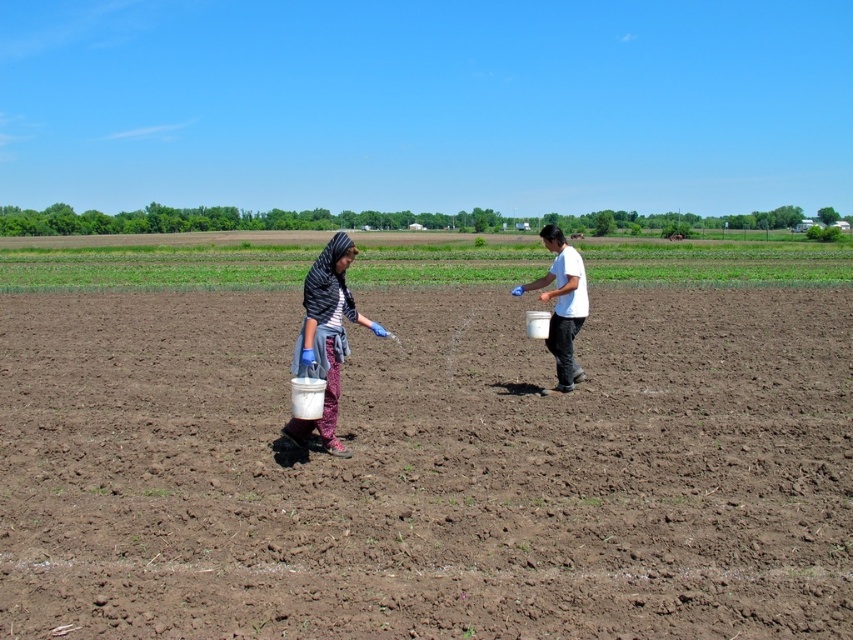
You are standing at the origin point in the field. There is a brown soil at center marked by point (x=428, y=470). If you walk straight north, will you reach the green trees before the brown soil at center?

The point (x=428, y=470) marks the brown soil at center, so walking north from the origin would head towards the green trees in the background first before reaching the brown soil at center.

You are a farmer planning to place the white plastic bucket at center on the brown soil at center. Based on their widths, will the bucket fit entirely on the soil without hanging over the edges?

The brown soil at center is wider than the white plastic bucket at center, so the bucket will fit entirely on the soil without hanging over the edges.

You are standing in the agricultural field and need to place a marker exactly at the center of the brown soil at center. According to the coordinates provided, where should you place the marker?

The brown soil at center is located at point (428, 470), so you should place the marker at those coordinates to mark its center.